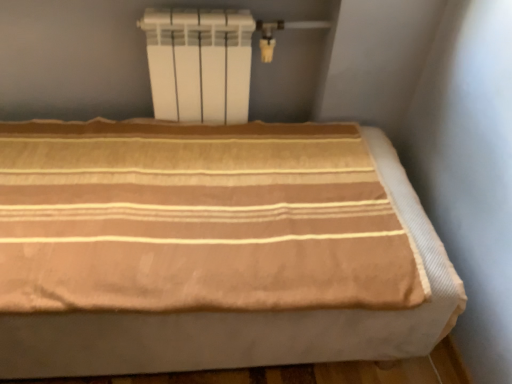
Question: Is beige striped fabric bed at center bigger or smaller than white matte radiator at upper center?

Choices:
 (A) big
 (B) small

Answer: (A)

Question: Is beige striped fabric bed at center in front of or behind white matte radiator at upper center in the image?

Choices:
 (A) behind
 (B) front

Answer: (B)

Question: Considering the positions of beige striped fabric bed at center and white matte radiator at upper center in the image, is beige striped fabric bed at center wider or thinner than white matte radiator at upper center?

Choices:
 (A) thin
 (B) wide

Answer: (B)

Question: From a real-world perspective, relative to beige striped fabric bed at center, is white matte radiator at upper center vertically above or below?

Choices:
 (A) below
 (B) above

Answer: (B)

Question: Do you think white matte radiator at upper center is within beige striped fabric bed at center, or outside of it?

Choices:
 (A) inside
 (B) outside

Answer: (B)

Question: From the image's perspective, relative to beige striped fabric bed at center, is white matte radiator at upper center above or below?

Choices:
 (A) below
 (B) above

Answer: (B)

Question: In terms of width, does white matte radiator at upper center look wider or thinner when compared to beige striped fabric bed at center?

Choices:
 (A) wide
 (B) thin

Answer: (B)